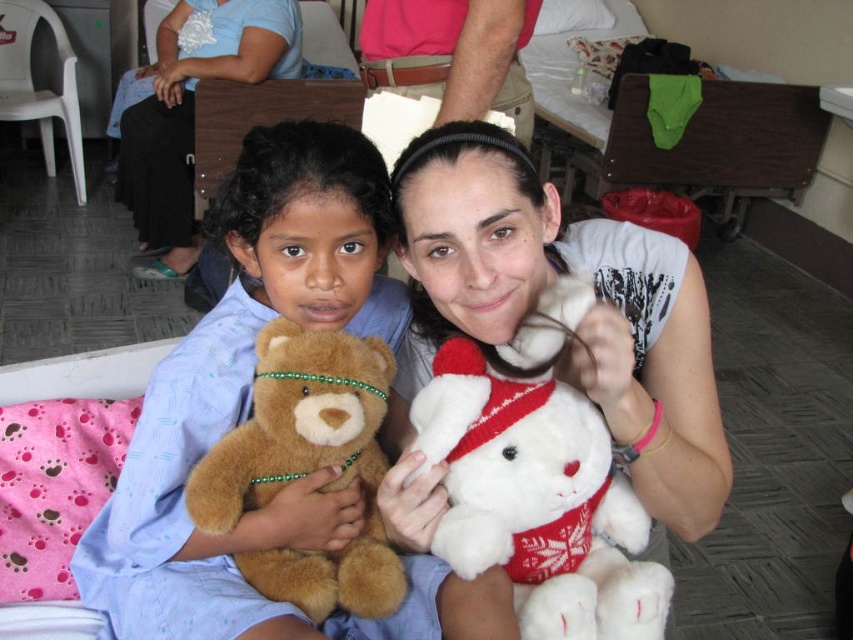
What are the coordinates of the white plush bear at center?

The white plush bear at center is located at point (x=579, y=323).

You are a photographer standing at the center of the room. You want to take a picture of the soft brown teddy bear at center. Where should you aim your camera to capture it perfectly?

You should aim your camera at the coordinates point (250, 401) to capture the soft brown teddy bear at center perfectly.

Looking at this image, you are a nurse in this hospital room. You need to check the vital signs of the young girl. The medical equipment is located at point (x=622, y=454). Can you reach the equipment without moving the adult woman?

The equipment is located at point (x=622, y=454), which is 34.40 inches away from the young girl. Since the adult woman is sitting next to the girl, you may need to move her slightly to access the equipment safely.